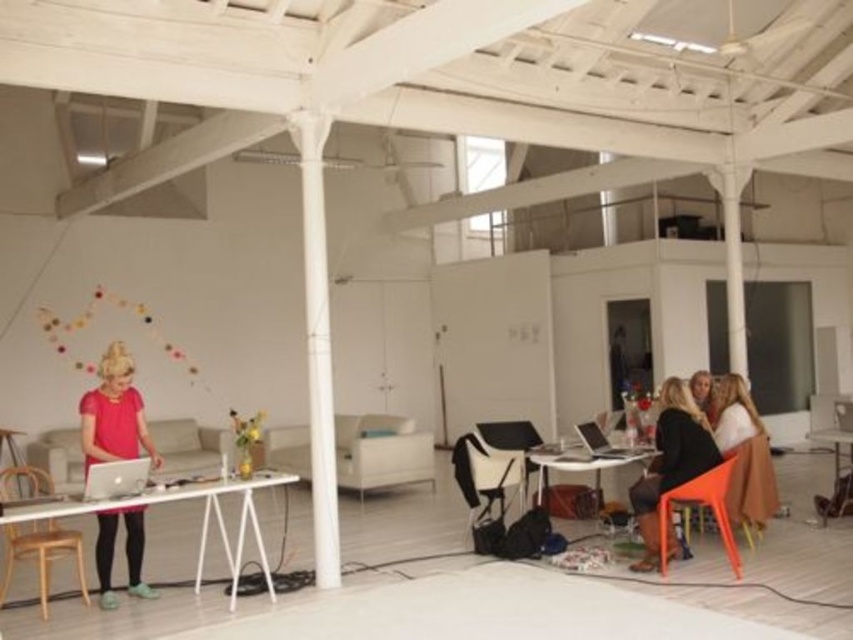
Question: Which object appears closest to the camera in this image?

Choices:
 (A) white plastic chair at center
 (B) wooden chair at lower left
 (C) pink matte dress at left

Answer: (C)

Question: In this image, where is white fabric couch at center located relative to silver metallic laptop at left?

Choices:
 (A) below
 (B) above

Answer: (A)

Question: Does orange plastic chair at lower right appear over silver metallic laptop at left?

Choices:
 (A) yes
 (B) no

Answer: (B)

Question: Which is nearer to the orange plastic chair at lower right?

Choices:
 (A) white plastic table at lower right
 (B) white fabric couch at center
 (C) smooth beige sweater at right
 (D) matte white table at lower right

Answer: (D)

Question: Which object is positioned closest to the pink matte dress at left?

Choices:
 (A) white fabric couch at center
 (B) white plastic table at lower right
 (C) matte white table at lower right

Answer: (C)

Question: Is orange plastic chair at lower right in front of smooth beige sweater at right?

Choices:
 (A) yes
 (B) no

Answer: (A)